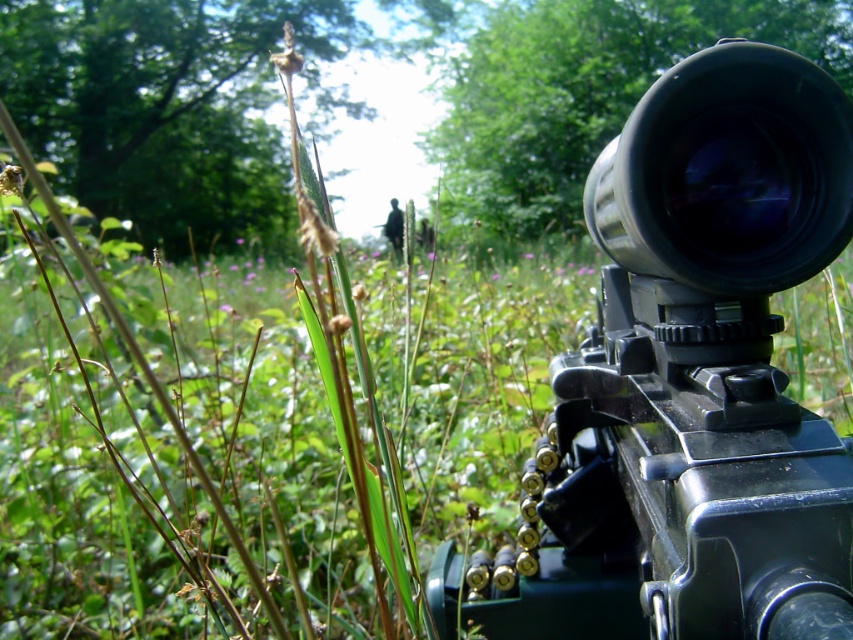
You are a photographer trying to capture the rifle in focus. The camera you are using has a depth of field that can only sharply focus on objects within 30 inches. Based on the scene description, is the point at coordinates point (560, 451) within the camera focus range?

The distance of point (560, 451) from the camera is 28.93 inches, which is within the 30 inches depth of field range. Therefore, the point at coordinates point (560, 451) will be in focus.

You are a photographer trying to capture a detailed image of the matte black rifle at center and the black matte lens at upper right. Since you want to ensure both are in focus, you need to know which object is bigger. Can you tell me which one is larger?

The matte black rifle at center is larger in size than the black matte lens at upper right, so you should focus on the matte black rifle at center first as it requires more detailed attention due to its size.

You are a photographer aiming to capture the matte black rifle at center in your shot. If your camera is focused at point 0.6, 0.8, will the rifle be in focus?

The matte black rifle at center is positioned at point (688, 381), which is very close to the camera focus point of (682, 384). Therefore, the rifle will be in focus.